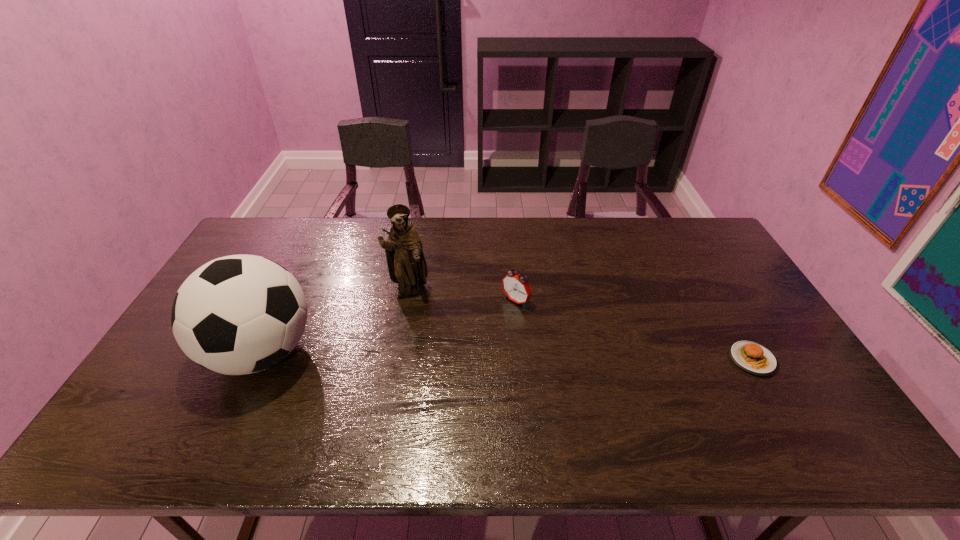
This screenshot has height=540, width=960. What are the coordinates of `vacant point located between the food and the alarm clock` in the screenshot? It's located at (634, 330).

Where is `unoccupied position between the figurine and the third object from left to right`? The image size is (960, 540). unoccupied position between the figurine and the third object from left to right is located at coordinates (462, 296).

At what (x,y) coordinates should I click in order to perform the action: click on free space between the second shortest object and the leftmost object. Please return your answer as a coordinate pair (x, y). Looking at the image, I should click on click(x=389, y=327).

Where is `free area in between the alarm clock and the rightmost object`? The width and height of the screenshot is (960, 540). free area in between the alarm clock and the rightmost object is located at coordinates [x=634, y=330].

This screenshot has height=540, width=960. I want to click on object that is the third closest to the soccer ball, so click(751, 357).

Identify the location of the closest object to the leftmost object. Image resolution: width=960 pixels, height=540 pixels. (406, 263).

Where is `vacant space that satisfies the following two spatial constraints: 1. on the front side of the second object from left to right; 2. on the left side of the third tallest object`? This screenshot has width=960, height=540. vacant space that satisfies the following two spatial constraints: 1. on the front side of the second object from left to right; 2. on the left side of the third tallest object is located at coordinates (406, 301).

What are the coordinates of `free space that satisfies the following two spatial constraints: 1. on the front side of the rightmost object; 2. on the left side of the second object from left to right` in the screenshot? It's located at (396, 359).

Find the location of `free space that satisfies the following two spatial constraints: 1. on the front side of the rightmost object; 2. on the right side of the alarm clock`. free space that satisfies the following two spatial constraints: 1. on the front side of the rightmost object; 2. on the right side of the alarm clock is located at coordinates (520, 359).